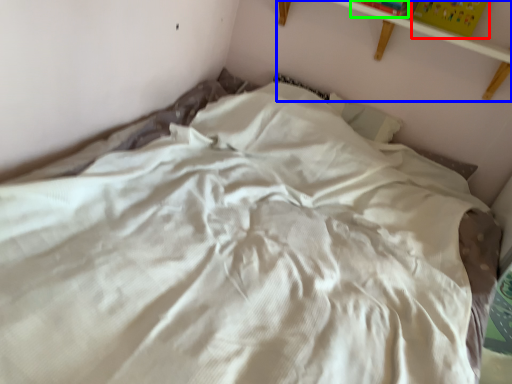
Question: Which is nearer to the paperback book (highlighted by a red box)? shelf (highlighted by a blue box) or paperback book (highlighted by a green box).

Choices:
 (A) shelf
 (B) paperback book

Answer: (A)